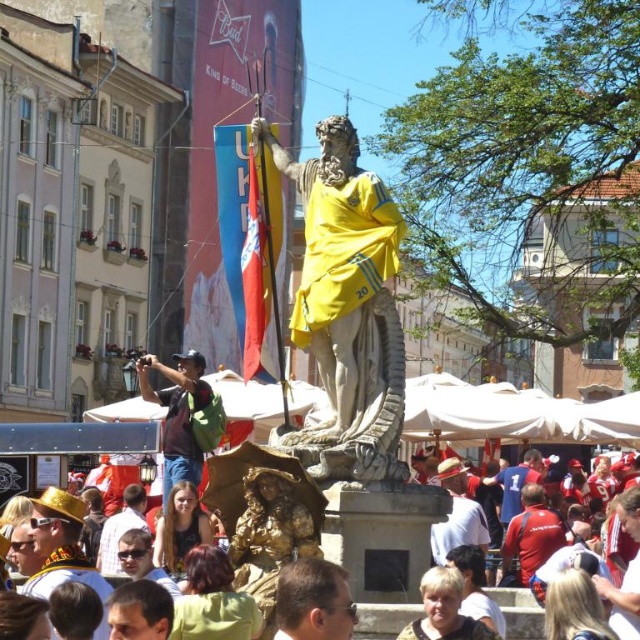
Who is taller, red fabric flag at center or gold metallic hat at lower left?

red fabric flag at center is taller.

Which is behind, point (282, 204) or point (36, 596)?

The point (282, 204) is more distant.

Who is more distant from viewer, (250, 324) or (108, 589)?

The point (250, 324) is more distant.

Locate an element on the screen. Image resolution: width=640 pixels, height=640 pixels. red fabric flag at center is located at coordinates (250, 243).

Does red fabric flag at center have a larger size compared to dark brown hair at lower center?

Indeed, red fabric flag at center has a larger size compared to dark brown hair at lower center.

Is point (264, 166) closer to camera compared to point (122, 596)?

No, (264, 166) is further to viewer.

Which is behind, point (216, 150) or point (154, 593)?

Positioned behind is point (216, 150).

Identify the location of red fabric flag at center. (250, 243).

Is red fabric shirt at center below red shirt at center?

Incorrect, red fabric shirt at center is not positioned below red shirt at center.

Is point (634, 636) positioned in front of point (538, 454)?

Yes, point (634, 636) is in front of point (538, 454).

The image size is (640, 640). In order to click on red fabric shirt at center in this screenshot , I will do `click(624, 600)`.